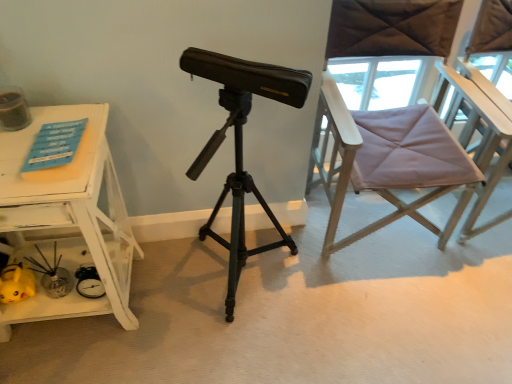
Find the location of a particular element. The image size is (512, 384). vacant region to the right of matte black tripod at center is located at coordinates (345, 306).